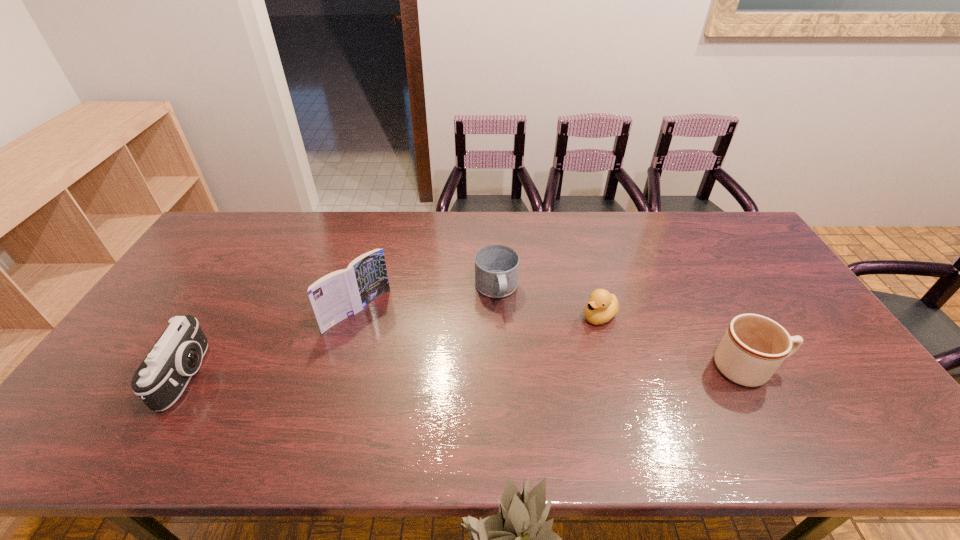
Identify the location of vacant space located on the front cover of the tallest object. (420, 364).

Identify the location of vacant point located 0.190m on the front cover of the tallest object. The width and height of the screenshot is (960, 540). (420, 364).

I want to click on free space located on the front cover of the tallest object, so click(x=457, y=396).

Image resolution: width=960 pixels, height=540 pixels. I want to click on vacant area situated on the side of the farther mug with the handle, so click(x=504, y=325).

At what (x,y) coordinates should I click in order to perform the action: click on vacant area located on the side of the farther mug with the handle. Please return your answer as a coordinate pair (x, y). Looking at the image, I should click on (525, 409).

The height and width of the screenshot is (540, 960). Find the location of `vacant space situated 0.250m on the side of the farther mug with the handle`. vacant space situated 0.250m on the side of the farther mug with the handle is located at coordinates (518, 381).

Where is `vacant space located facing forward on the duckling`? The width and height of the screenshot is (960, 540). vacant space located facing forward on the duckling is located at coordinates (574, 332).

Locate an element on the screen. The image size is (960, 540). vacant area located facing forward on the duckling is located at coordinates (501, 382).

Identify the location of free spot located facing forward on the duckling. (492, 388).

Image resolution: width=960 pixels, height=540 pixels. I want to click on camera that is at the near edge, so click(163, 375).